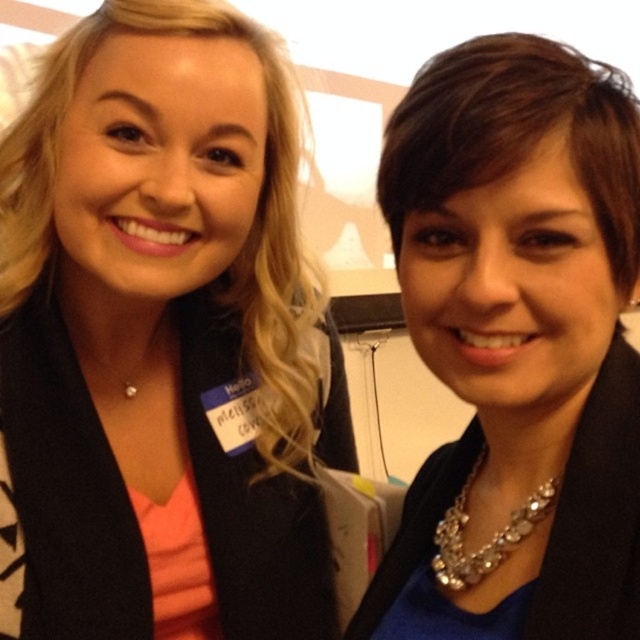
You are standing in front of the image and want to describe the position of the matte black blazer at center. What are its coordinates?

The matte black blazer at center is located at coordinates point (163, 340).

You are a photographer adjusting the camera settings to focus on the sparkly silver necklace at center and the matte black blazer at center. Which object is closer to the camera?

The sparkly silver necklace at center is behind the matte black blazer at center, so the matte black blazer at center is closer to the camera.

You are standing in the conference room where the photo was taken. You need to place a small decoration exactly at the location of point (472, 276) and another decoration at point (435, 531). Which decoration will be closer to the camera?

The decoration placed at point (472, 276) will be closer to the camera because it is in front of point (435, 531).